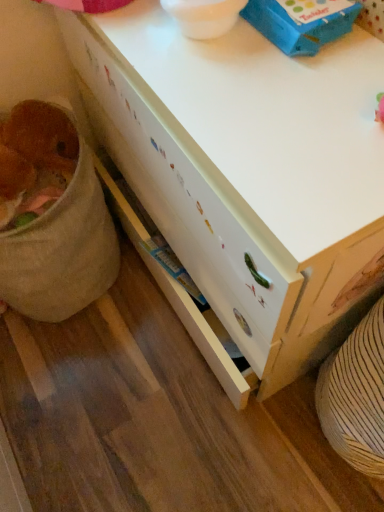
Question: From the image's perspective, does blue cardboard box at upper center appear higher than fuzzy brown stuffed animal at lower left?

Choices:
 (A) yes
 (B) no

Answer: (A)

Question: Is blue cardboard box at upper center further to camera compared to fuzzy brown stuffed animal at lower left?

Choices:
 (A) no
 (B) yes

Answer: (A)

Question: From a real-world perspective, is blue cardboard box at upper center beneath fuzzy brown stuffed animal at lower left?

Choices:
 (A) yes
 (B) no

Answer: (B)

Question: From the image's perspective, is blue cardboard box at upper center located beneath fuzzy brown stuffed animal at lower left?

Choices:
 (A) no
 (B) yes

Answer: (A)

Question: Can we say blue cardboard box at upper center lies outside fuzzy brown stuffed animal at lower left?

Choices:
 (A) yes
 (B) no

Answer: (A)

Question: Is blue cardboard box at upper center looking in the opposite direction of fuzzy brown stuffed animal at lower left?

Choices:
 (A) yes
 (B) no

Answer: (B)

Question: From the image's perspective, is fuzzy brown stuffed animal at lower left under blue cardboard box at upper center?

Choices:
 (A) yes
 (B) no

Answer: (A)

Question: Considering the relative sizes of fuzzy brown stuffed animal at lower left and blue cardboard box at upper center in the image provided, is fuzzy brown stuffed animal at lower left bigger than blue cardboard box at upper center?

Choices:
 (A) yes
 (B) no

Answer: (A)

Question: Does fuzzy brown stuffed animal at lower left appear on the left side of blue cardboard box at upper center?

Choices:
 (A) no
 (B) yes

Answer: (B)

Question: Could you tell me if fuzzy brown stuffed animal at lower left is turned towards blue cardboard box at upper center?

Choices:
 (A) no
 (B) yes

Answer: (A)

Question: Is fuzzy brown stuffed animal at lower left turned away from blue cardboard box at upper center?

Choices:
 (A) yes
 (B) no

Answer: (B)

Question: Is fuzzy brown stuffed animal at lower left to the right of blue cardboard box at upper center from the viewer's perspective?

Choices:
 (A) no
 (B) yes

Answer: (A)

Question: Considering the relative sizes of white wood desk at center and fuzzy brown stuffed animal at lower left in the image provided, is white wood desk at center smaller than fuzzy brown stuffed animal at lower left?

Choices:
 (A) no
 (B) yes

Answer: (A)